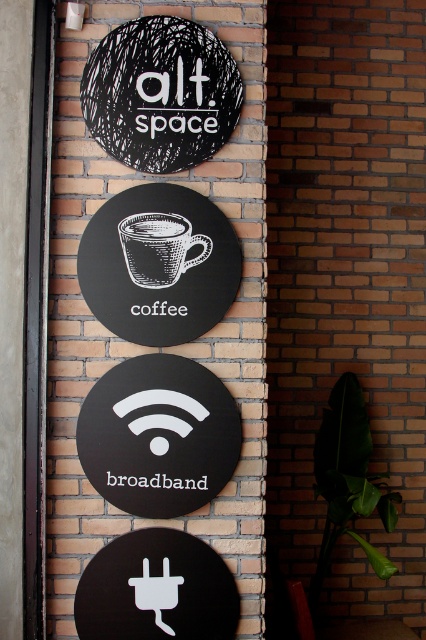
Is point (201, 193) farther from viewer compared to point (195, 260)?

Yes, point (201, 193) is behind point (195, 260).

Can you confirm if black matte sign at center is thinner than white textured coffee cup at center?

No.

Locate an element on the screen. black matte sign at center is located at coordinates (149, 346).